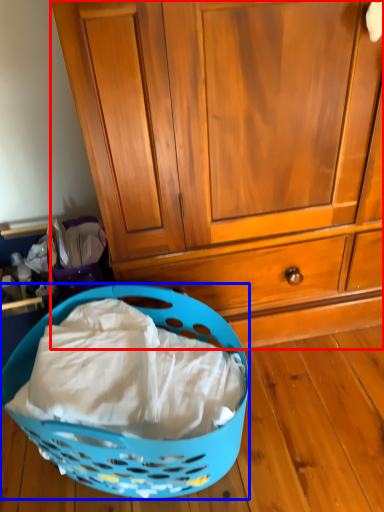
Question: Which object appears farthest to the camera in this image, cabinetry (highlighted by a red box) or picnic basket (highlighted by a blue box)?

Choices:
 (A) cabinetry
 (B) picnic basket

Answer: (A)